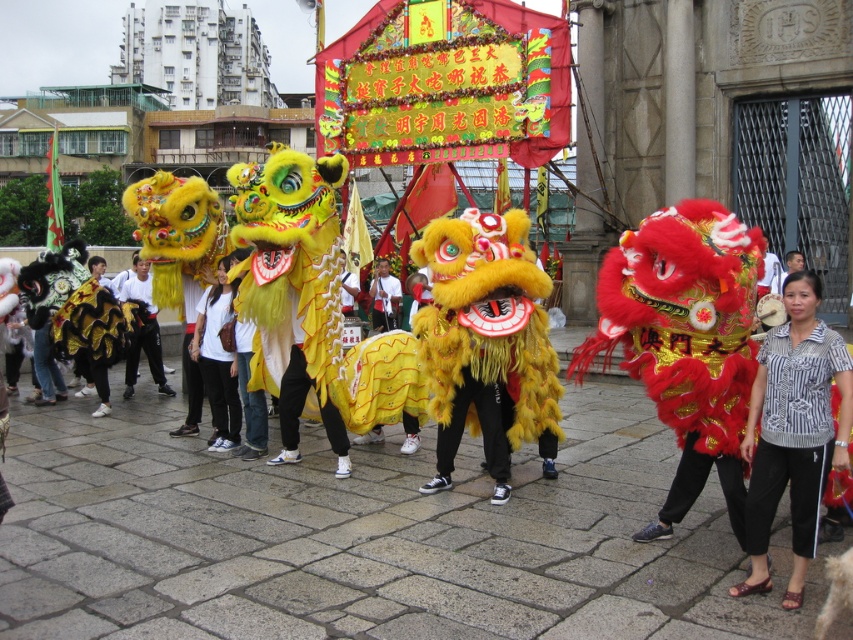
Question: Which point is farther to the camera?

Choices:
 (A) (836, 372)
 (B) (689, 589)
 (C) (387, 326)

Answer: (C)

Question: Does yellow fuzzy lion at center have a smaller size compared to striped shirt at center?

Choices:
 (A) no
 (B) yes

Answer: (A)

Question: Which point is farther to the camera?

Choices:
 (A) (811, 344)
 (B) (378, 305)

Answer: (B)

Question: Considering the relative positions of striped shirt at center and white cotton shirt at center in the image provided, where is striped shirt at center located with respect to white cotton shirt at center?

Choices:
 (A) right
 (B) left

Answer: (A)

Question: Is yellow fuzzy lion at center smaller than white cotton shirt at center?

Choices:
 (A) no
 (B) yes

Answer: (A)

Question: Estimate the real-world distances between objects in this image. Which object is farther from the striped shirt at center?

Choices:
 (A) yellow fuzzy lion at center
 (B) white cotton shirt at center

Answer: (B)